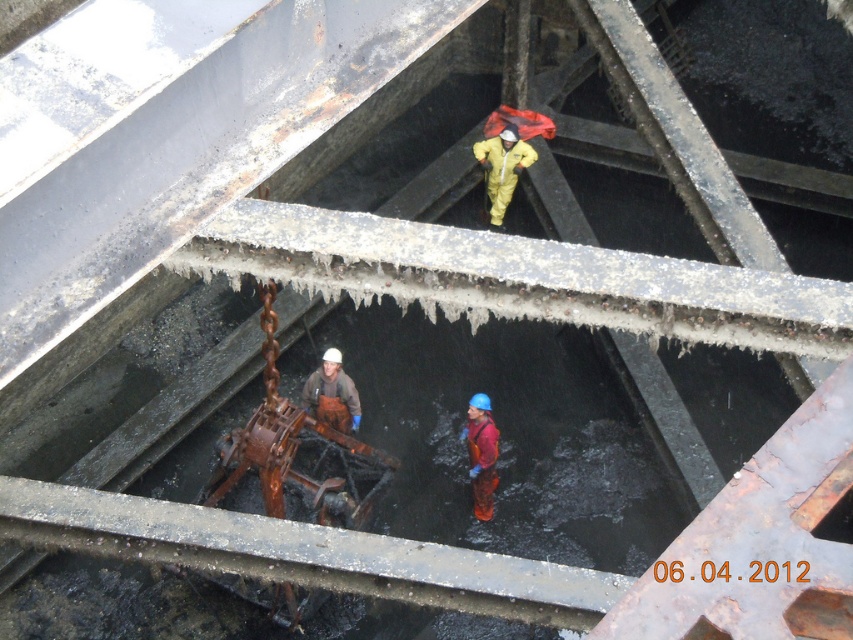
Question: Considering the real-world distances, which object is closest to the yellow matte suit at center?

Choices:
 (A) brown leather boots at center
 (B) red rubber suit at center

Answer: (B)

Question: Can you confirm if yellow matte suit at center is wider than red rubber suit at center?

Choices:
 (A) yes
 (B) no

Answer: (A)

Question: Which object appears farthest from the camera in this image?

Choices:
 (A) yellow matte suit at center
 (B) red rubber suit at center

Answer: (A)

Question: Which object appears closest to the camera in this image?

Choices:
 (A) brown leather boots at center
 (B) red rubber suit at center
 (C) yellow matte suit at center

Answer: (A)

Question: Can you confirm if yellow matte suit at center is smaller than brown leather boots at center?

Choices:
 (A) yes
 (B) no

Answer: (B)

Question: Does yellow matte suit at center have a larger size compared to red rubber suit at center?

Choices:
 (A) no
 (B) yes

Answer: (B)